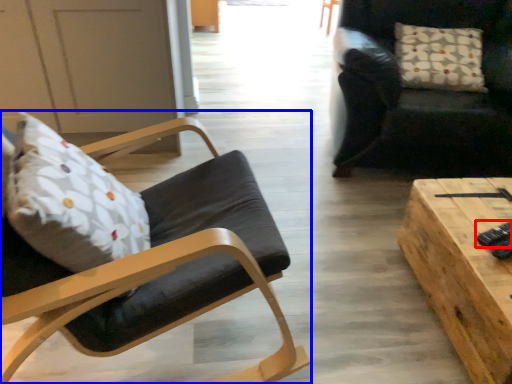
Question: Which object appears closest to the camera in this image, remote control (highlighted by a red box) or chair (highlighted by a blue box)?

Choices:
 (A) remote control
 (B) chair

Answer: (B)